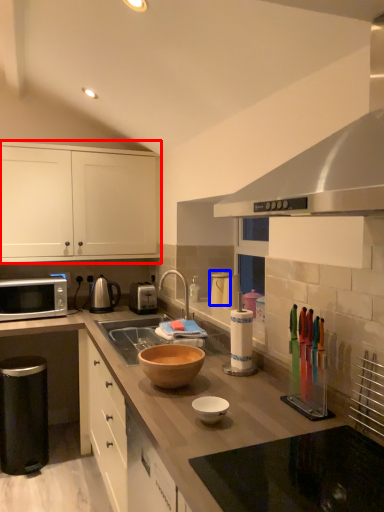
Question: Which object is further to the camera taking this photo, cabinetry (highlighted by a red box) or appliance (highlighted by a blue box)?

Choices:
 (A) cabinetry
 (B) appliance

Answer: (A)